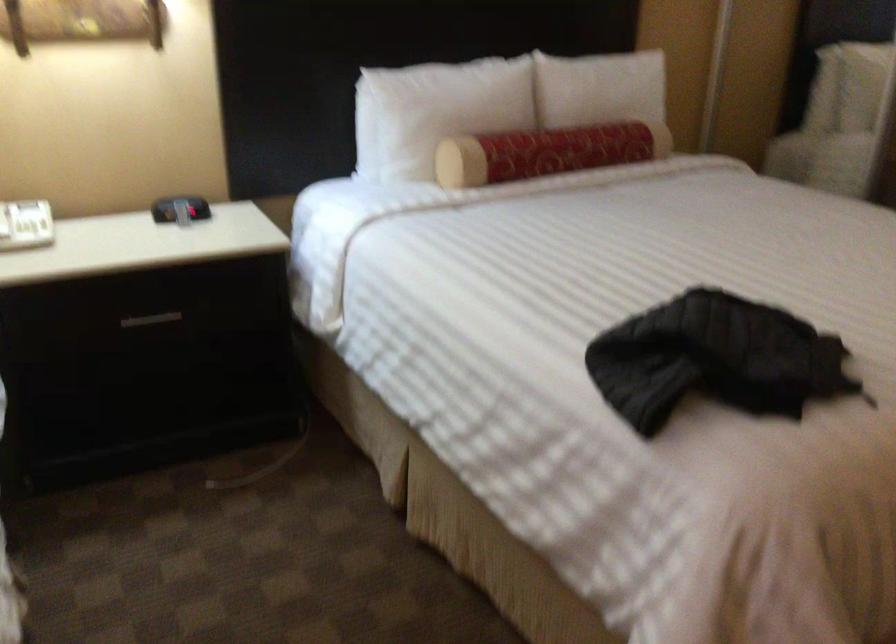
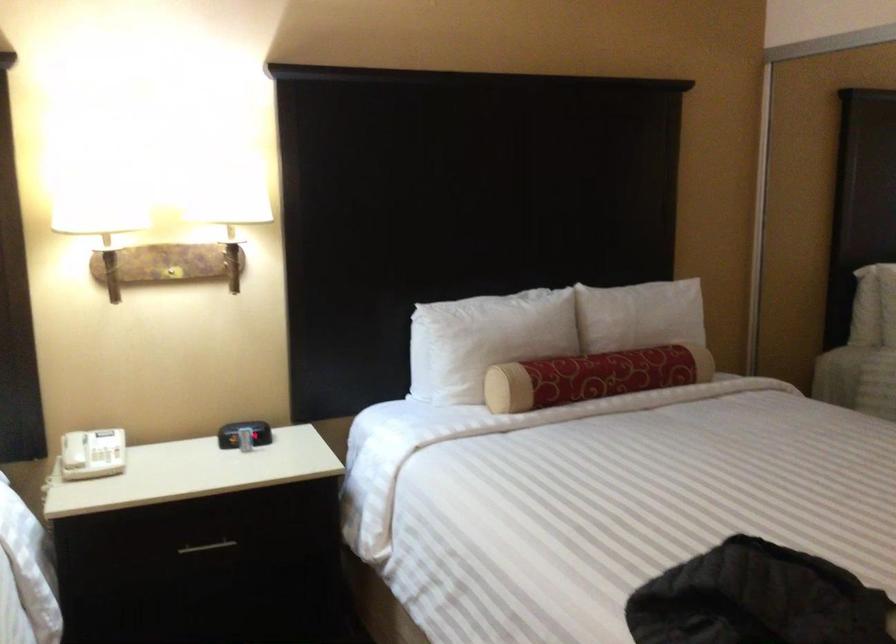
Question: How did the camera likely rotate?

Choices:
 (A) Left
 (B) Right
 (C) Up
 (D) Down

Answer: (C)